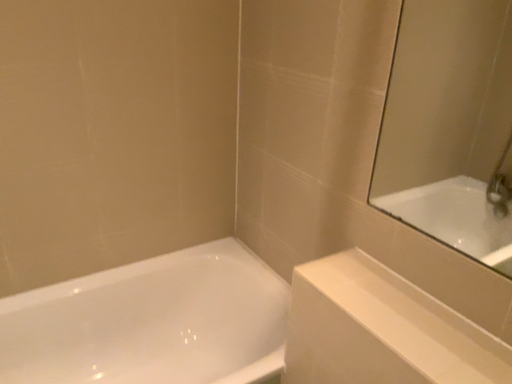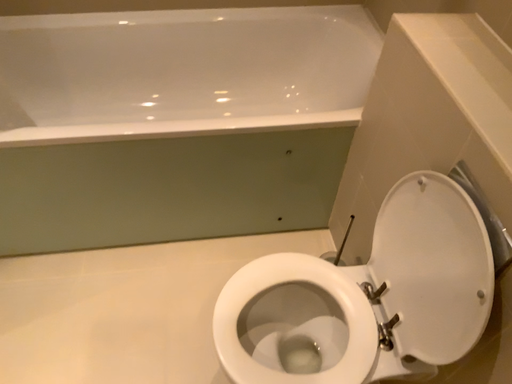
Question: Which way did the camera rotate in the video?

Choices:
 (A) rotated upward
 (B) rotated downward

Answer: (B)